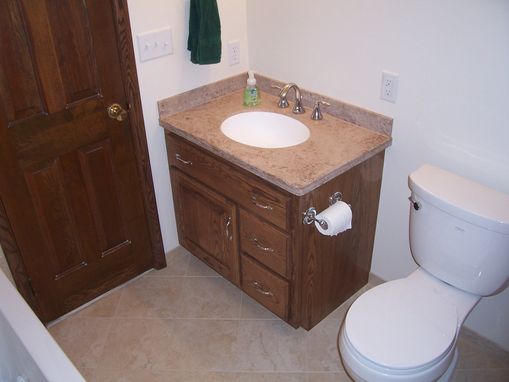
Locate an element on the screen. toilet tank is located at coordinates (444, 234).